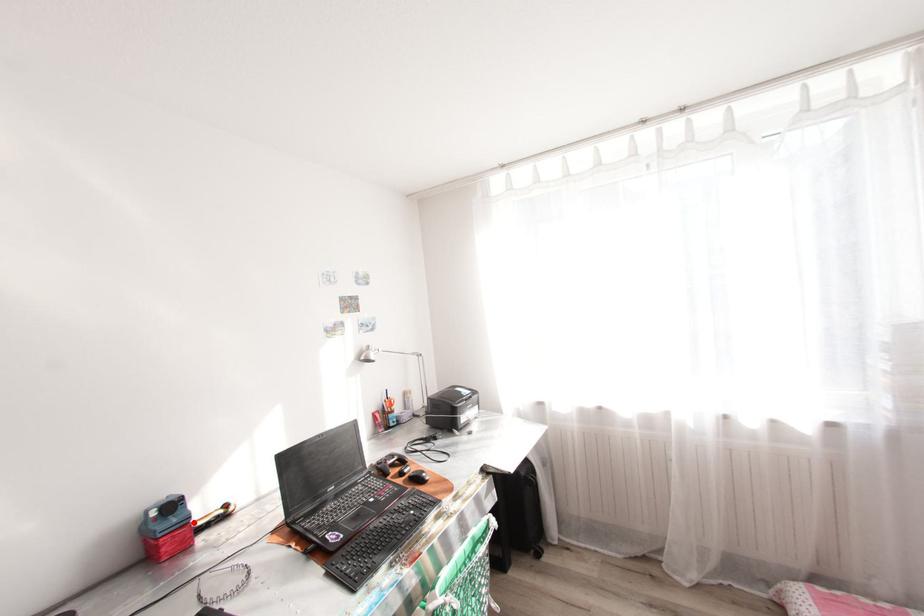
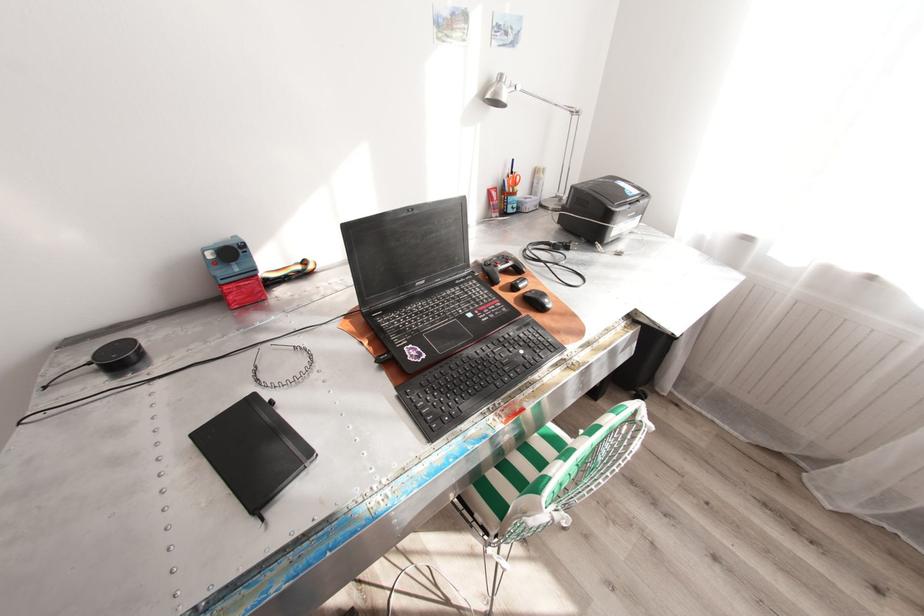
In the second image, find the point that corresponds to the highlighted location in the first image.

(261, 275)